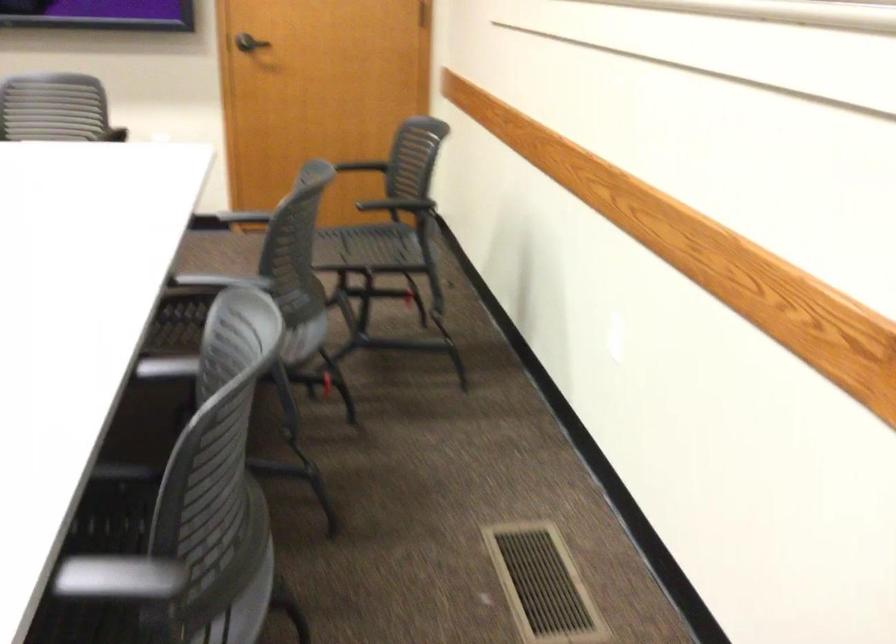
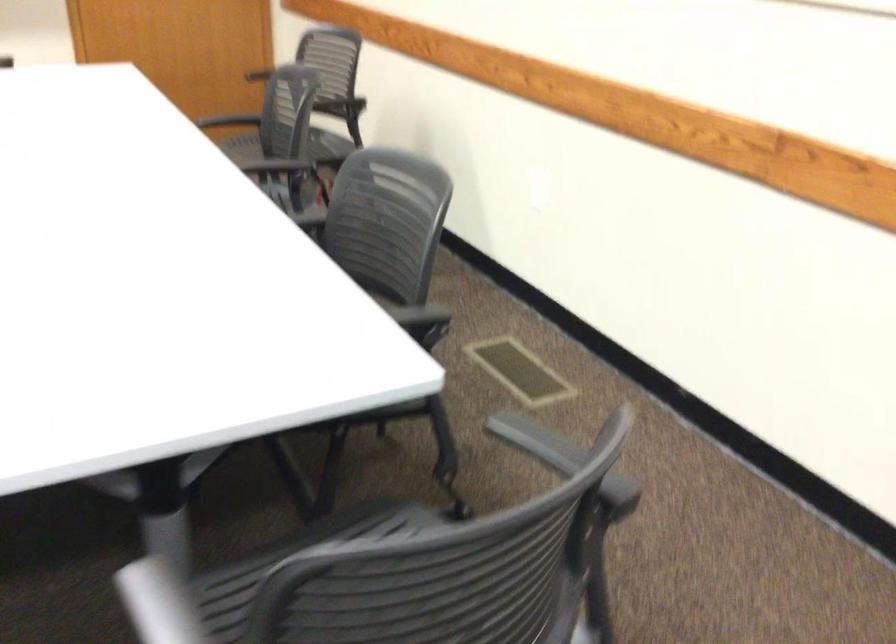
Locate, in the second image, the point that corresponds to (160,564) in the first image.

(419, 315)